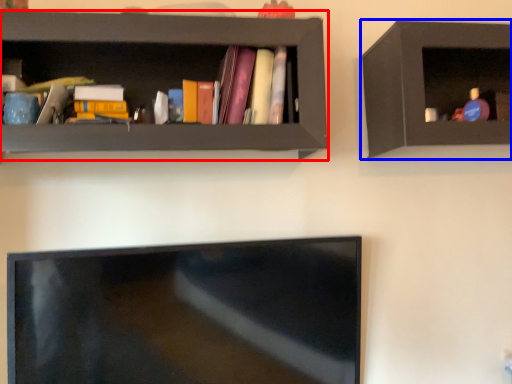
Question: Which object is closer to the camera taking this photo, shelf (highlighted by a red box) or shelf (highlighted by a blue box)?

Choices:
 (A) shelf
 (B) shelf

Answer: (A)